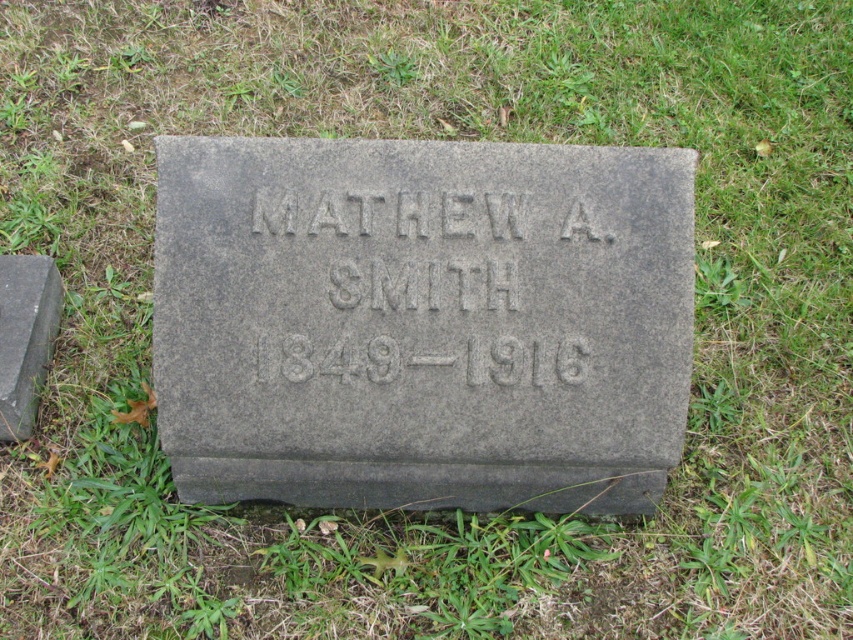
Who is positioned more to the left, gray stone inscription at center or gray stone at left?

From the viewer's perspective, gray stone at left appears more on the left side.

At what (x,y) coordinates should I click in order to perform the action: click on gray stone inscription at center. Please return your answer as a coordinate pair (x, y). Image resolution: width=853 pixels, height=640 pixels. Looking at the image, I should click on (392, 216).

Is point (265, 230) more distant than point (44, 305)?

No, it is not.

The image size is (853, 640). Find the location of `gray stone inscription at center`. gray stone inscription at center is located at coordinates (392, 216).

Does point (407, 461) come farther from viewer compared to point (258, 189)?

Yes.

Who is higher up, gray stone gravestone at center or gray stone inscription at center?

gray stone inscription at center is above.

This screenshot has height=640, width=853. I want to click on gray stone gravestone at center, so click(422, 321).

Between gray stone gravestone at center and gray stone at left, which one appears on the right side from the viewer's perspective?

Positioned to the right is gray stone gravestone at center.

Is point (231, 417) closer to camera compared to point (51, 324)?

Yes, point (231, 417) is closer to viewer.

The image size is (853, 640). Find the location of `gray stone gravestone at center`. gray stone gravestone at center is located at coordinates (422, 321).

The height and width of the screenshot is (640, 853). Identify the location of gray stone gravestone at center. (422, 321).